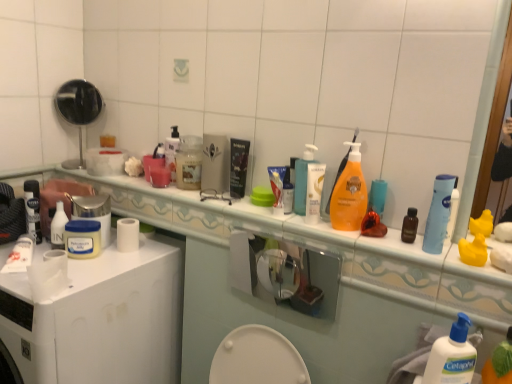
Locate an element on the screen. vacant area that is in front of white plastic container at center is located at coordinates (104, 268).